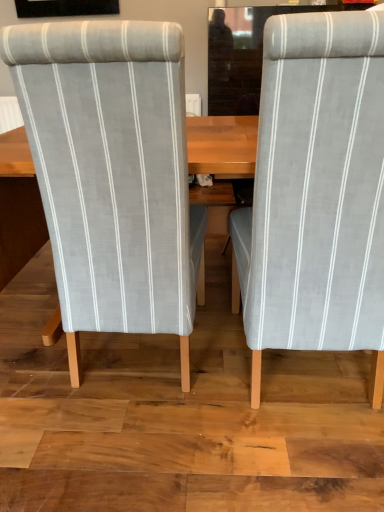
At what (x,y) coordinates should I click in order to perform the action: click on free location to the left of gray fabric chair at right, the second chair positioned from the left. Please return your answer as a coordinate pair (x, y). Looking at the image, I should click on (171, 407).